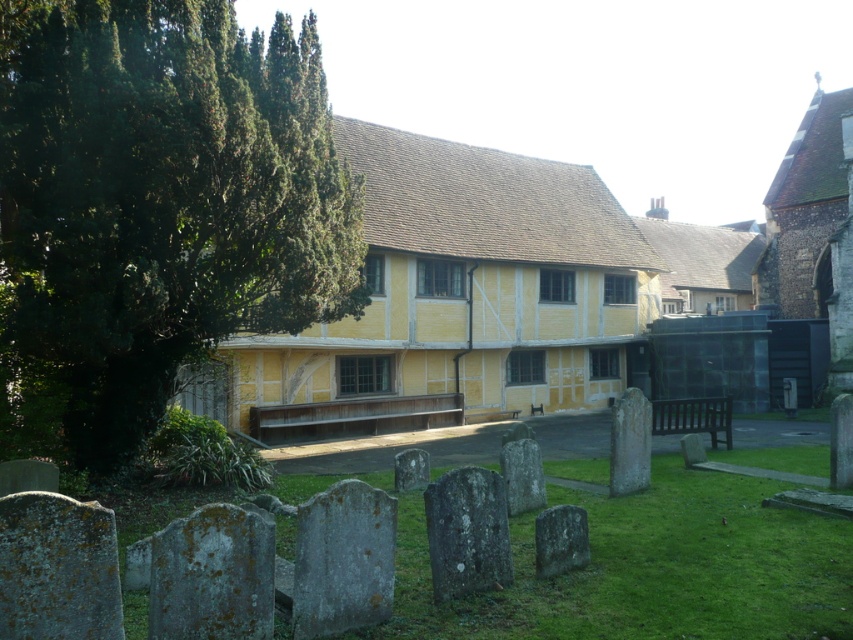
You are standing at point (459, 298) in the scene. What object is located exactly at your current position?

The yellow timber framed building at center is located exactly at point (459, 298).

You are standing at the historic yellow building and want to walk to a specific location. You see two points marked on the ground labeled as point (192, 33) and point (360, 129). Which point is closer to the entrance of the building?

Point (192, 33) is in front of point (360, 129), so it is closer to the entrance of the historic yellow building.